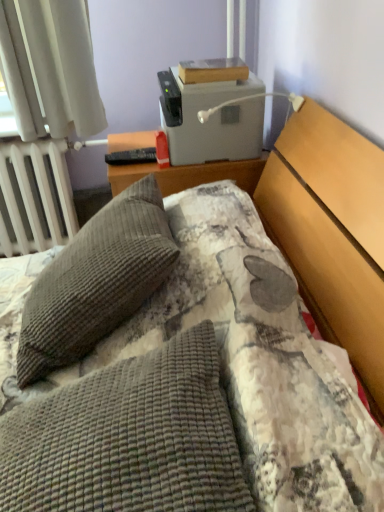
Question: Is gray corduroy pillow at left, acting as the second pillow starting from the front, not within gray plastic printer at upper center?

Choices:
 (A) no
 (B) yes

Answer: (B)

Question: Is gray corduroy pillow at left, which appears as the first pillow when viewed from the back, in contact with gray plastic printer at upper center?

Choices:
 (A) yes
 (B) no

Answer: (B)

Question: From a real-world perspective, is gray corduroy pillow at left, acting as the second pillow starting from the front, on top of gray plastic printer at upper center?

Choices:
 (A) yes
 (B) no

Answer: (B)

Question: Is gray corduroy pillow at left, acting as the second pillow starting from the front, oriented towards gray plastic printer at upper center?

Choices:
 (A) yes
 (B) no

Answer: (B)

Question: From the image's perspective, does gray corduroy pillow at left, acting as the second pillow starting from the front, appear higher than gray plastic printer at upper center?

Choices:
 (A) no
 (B) yes

Answer: (A)

Question: Considering the relative positions of white metallic radiator at left and brown corduroy pillow at center, the 2th pillow viewed from the back, in the image provided, is white metallic radiator at left to the left or to the right of brown corduroy pillow at center, the 2th pillow viewed from the back,?

Choices:
 (A) left
 (B) right

Answer: (A)

Question: Is white metallic radiator at left in front of or behind brown corduroy pillow at center, the 2th pillow viewed from the back, in the image?

Choices:
 (A) behind
 (B) front

Answer: (A)

Question: From the image's perspective, is white metallic radiator at left above or below brown corduroy pillow at center, which is the first pillow in front-to-back order?

Choices:
 (A) below
 (B) above

Answer: (B)

Question: Based on their sizes in the image, would you say white metallic radiator at left is bigger or smaller than brown corduroy pillow at center, the 2th pillow viewed from the back?

Choices:
 (A) big
 (B) small

Answer: (B)

Question: Is white metallic radiator at left inside or outside of white plastic lamp at upper right?

Choices:
 (A) outside
 (B) inside

Answer: (A)

Question: From a real-world perspective, relative to white plastic lamp at upper right, is white metallic radiator at left vertically above or below?

Choices:
 (A) above
 (B) below

Answer: (B)

Question: In terms of width, does white metallic radiator at left look wider or thinner when compared to white plastic lamp at upper right?

Choices:
 (A) thin
 (B) wide

Answer: (A)

Question: From the image's perspective, is white metallic radiator at left above or below white plastic lamp at upper right?

Choices:
 (A) above
 (B) below

Answer: (B)

Question: Visually, is gray corduroy pillow at left, which appears as the first pillow when viewed from the back, positioned to the left or to the right of brown corduroy pillow at center, which is the first pillow in front-to-back order?

Choices:
 (A) right
 (B) left

Answer: (B)

Question: Considering the positions of gray corduroy pillow at left, acting as the second pillow starting from the front, and brown corduroy pillow at center, the 2th pillow viewed from the back, in the image, is gray corduroy pillow at left, acting as the second pillow starting from the front, bigger or smaller than brown corduroy pillow at center, the 2th pillow viewed from the back,?

Choices:
 (A) big
 (B) small

Answer: (A)